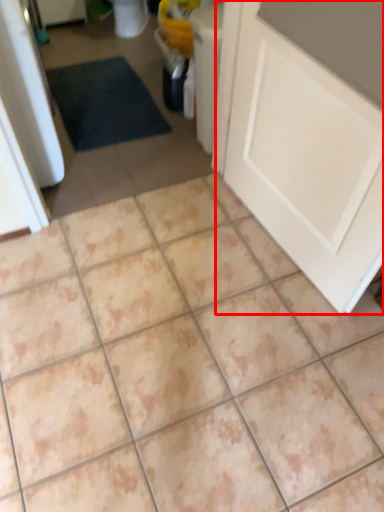
Question: From the image's perspective, what is the correct spatial positioning of door (annotated by the red box) in reference to ceramic tile?

Choices:
 (A) below
 (B) above

Answer: (A)